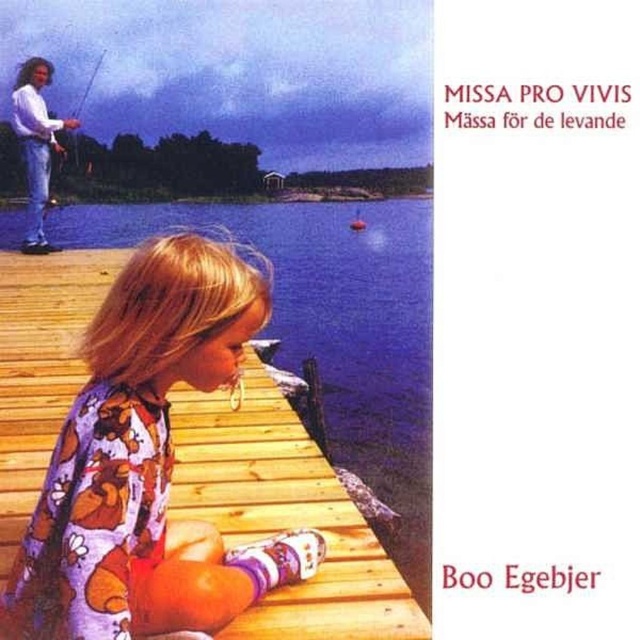
Is point (48, 70) behind point (52, 177)?

No.

Is point (19, 106) in front of point (99, 52)?

That is True.

Which is behind, point (29, 241) or point (60, 148)?

The point (60, 148) is behind.

At what (x,y) coordinates should I click in order to perform the action: click on white matte shirt at upper left. Please return your answer as a coordinate pair (x, y). Looking at the image, I should click on (36, 145).

Which is above, purple printed dress at center or matte white fishing pole at upper left?

Positioned higher is matte white fishing pole at upper left.

What do you see at coordinates (147, 464) in the screenshot? This screenshot has height=640, width=640. I see `purple printed dress at center` at bounding box center [147, 464].

In order to click on purple printed dress at center in this screenshot , I will do `click(147, 464)`.

Which is more to the right, purple printed dress at center or white matte shirt at upper left?

purple printed dress at center is more to the right.

Does point (81, 614) come in front of point (33, 163)?

Yes, point (81, 614) is in front of point (33, 163).

The height and width of the screenshot is (640, 640). In order to click on purple printed dress at center in this screenshot , I will do `click(147, 464)`.

Where is `purple printed dress at center`? Image resolution: width=640 pixels, height=640 pixels. purple printed dress at center is located at coordinates (147, 464).